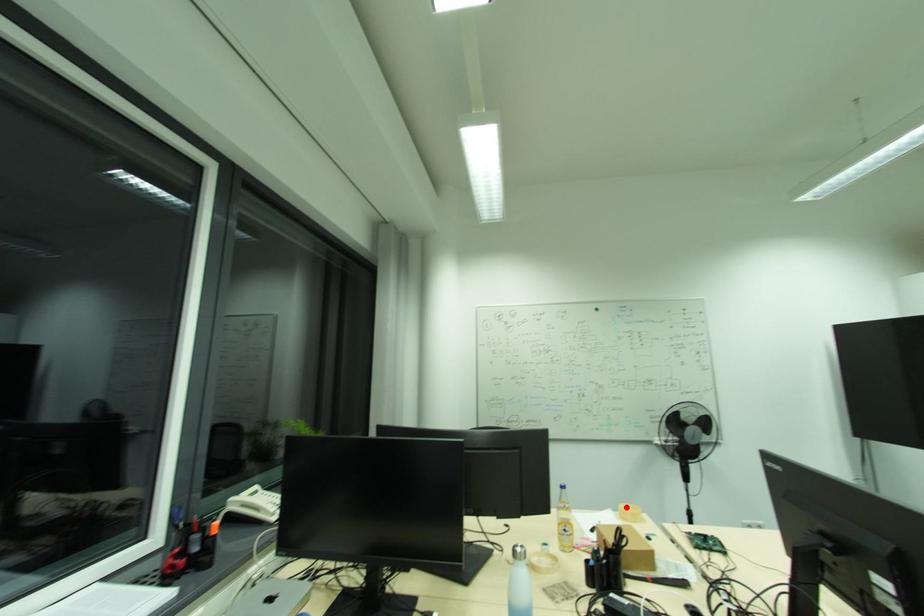
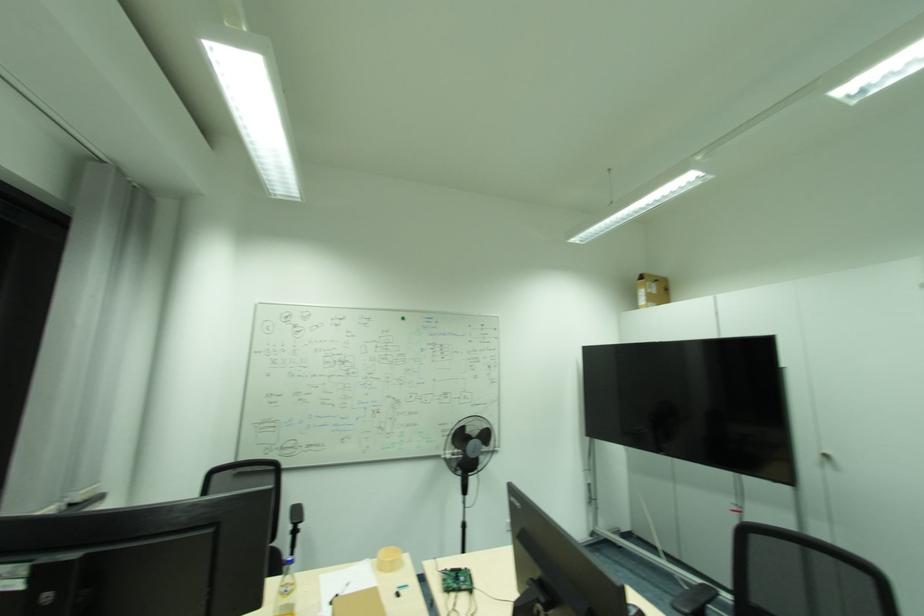
Where in the second image is the point corresponding to the highlighted location from the first image?

(386, 553)